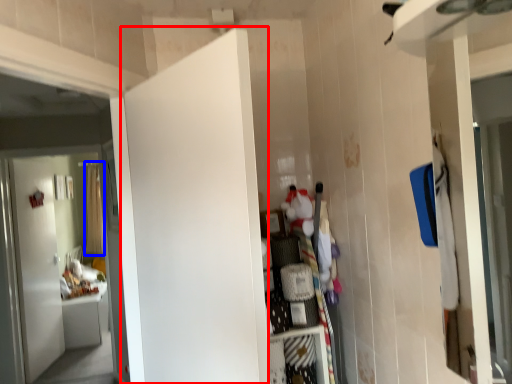
Question: Which of the following is the farthest to the observer, door (highlighted by a red box) or curtain (highlighted by a blue box)?

Choices:
 (A) door
 (B) curtain

Answer: (B)